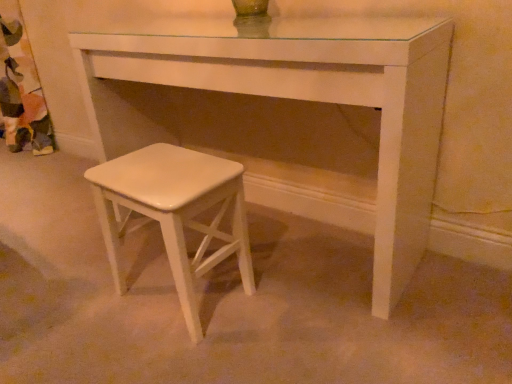
At what (x,y) coordinates should I click in order to perform the action: click on white glossy stool at lower left. Please return your answer as a coordinate pair (x, y). The height and width of the screenshot is (384, 512). Looking at the image, I should click on (291, 99).

The image size is (512, 384). What do you see at coordinates (291, 99) in the screenshot?
I see `white glossy stool at lower left` at bounding box center [291, 99].

Find the location of a particular element. The width and height of the screenshot is (512, 384). white glossy stool at lower left is located at coordinates (175, 212).

Image resolution: width=512 pixels, height=384 pixels. Describe the element at coordinates (175, 212) in the screenshot. I see `white glossy stool at lower left` at that location.

Find the location of a particular element. The height and width of the screenshot is (384, 512). white glossy stool at lower left is located at coordinates (291, 99).

In the scene shown: Which object is positioned more to the right, white glossy stool at lower left or white glossy stool at lower left?

Positioned to the right is white glossy stool at lower left.

Is white glossy stool at lower left in front of or behind white glossy stool at lower left in the image?

Visually, white glossy stool at lower left is located behind white glossy stool at lower left.

Is point (173, 272) positioned after point (156, 32)?

No, it is not.

From the image's perspective, is white glossy stool at lower left below white glossy stool at lower left?

Yes, from the image's perspective, white glossy stool at lower left is beneath white glossy stool at lower left.

From a real-world perspective, is white glossy stool at lower left on top of white glossy stool at lower left?

Actually, white glossy stool at lower left is physically below white glossy stool at lower left in the real world.

Between white glossy stool at lower left and white glossy stool at lower left, which one has smaller width?

Thinner between the two is white glossy stool at lower left.

Consider the image. Is white glossy stool at lower left taller than white glossy stool at lower left?

No.

Can you confirm if white glossy stool at lower left is bigger than white glossy stool at lower left?

Actually, white glossy stool at lower left might be smaller than white glossy stool at lower left.

From the picture: Is white glossy stool at lower left inside the boundaries of white glossy stool at lower left, or outside?

white glossy stool at lower left is outside white glossy stool at lower left.

In the scene shown: Would you consider white glossy stool at lower left to be distant from white glossy stool at lower left?

No, white glossy stool at lower left is in close proximity to white glossy stool at lower left.

Is white glossy stool at lower left aimed at white glossy stool at lower left?

No, white glossy stool at lower left is not aimed at white glossy stool at lower left.

How many degrees apart are the facing directions of white glossy stool at lower left and white glossy stool at lower left?

The angular difference between white glossy stool at lower left and white glossy stool at lower left is 0.178 degrees.

Identify the location of stool below the white glossy stool at lower left (from a real-world perspective). The width and height of the screenshot is (512, 384). (175, 212).

Considering the relative positions of white glossy stool at lower left and white glossy stool at lower left in the image provided, is white glossy stool at lower left to the right of white glossy stool at lower left from the viewer's perspective?

Indeed, white glossy stool at lower left is positioned on the right side of white glossy stool at lower left.

Is white glossy stool at lower left in front of or behind white glossy stool at lower left in the image?

white glossy stool at lower left is in front of white glossy stool at lower left.

Which point is more distant from viewer, (96, 58) or (179, 200)?

Point (96, 58)

From the image's perspective, between white glossy stool at lower left and white glossy stool at lower left, who is located below?

From the image's view, white glossy stool at lower left is below.

From a real-world perspective, is white glossy stool at lower left physically located above or below white glossy stool at lower left?

white glossy stool at lower left is situated higher than white glossy stool at lower left in the real world.

Does white glossy stool at lower left have a lesser width compared to white glossy stool at lower left?

In fact, white glossy stool at lower left might be wider than white glossy stool at lower left.

From the picture: Considering the sizes of objects white glossy stool at lower left and white glossy stool at lower left in the image provided, who is taller, white glossy stool at lower left or white glossy stool at lower left?

white glossy stool at lower left.

Who is smaller, white glossy stool at lower left or white glossy stool at lower left?

With smaller size is white glossy stool at lower left.

Is white glossy stool at lower left located within white glossy stool at lower left?

Definitely not — white glossy stool at lower left is not inside white glossy stool at lower left.

Can you see white glossy stool at lower left touching white glossy stool at lower left?

white glossy stool at lower left and white glossy stool at lower left are not in contact.

Is white glossy stool at lower left facing towards white glossy stool at lower left?

Yes, white glossy stool at lower left is aimed at white glossy stool at lower left.

What's the angular difference between white glossy stool at lower left and white glossy stool at lower left's facing directions?

There is a 0.178-degree angle between the facing directions of white glossy stool at lower left and white glossy stool at lower left.

Find the location of a particular element. table in front of the white glossy stool at lower left is located at coordinates (291, 99).

This screenshot has height=384, width=512. In order to click on stool on the left of white glossy stool at lower left in this screenshot , I will do `click(175, 212)`.

Identify the location of table above the white glossy stool at lower left (from the image's perspective). The height and width of the screenshot is (384, 512). (291, 99).